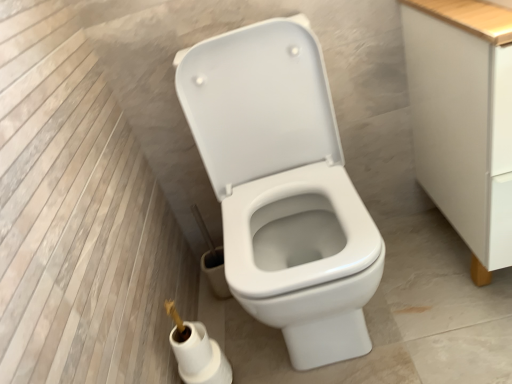
Identify the location of white matte cabinet at right. (464, 119).

Considering the relative positions of white matte toilet paper at lower center and white glossy toilet at center in the image provided, is white matte toilet paper at lower center to the right of white glossy toilet at center from the viewer's perspective?

No, white matte toilet paper at lower center is not to the right of white glossy toilet at center.

Does white matte toilet paper at lower center have a smaller size compared to white glossy toilet at center?

Indeed, white matte toilet paper at lower center has a smaller size compared to white glossy toilet at center.

From a real-world perspective, is white matte toilet paper at lower center positioned above or below white glossy toilet at center?

white matte toilet paper at lower center is situated lower than white glossy toilet at center in the real world.

Between point (467, 141) and point (248, 222), which one is positioned behind?

The point (248, 222) is farther.

From the image's perspective, which one is positioned lower, white matte cabinet at right or white glossy toilet at center?

white glossy toilet at center is shown below in the image.

Is white matte cabinet at right in front of or behind white glossy toilet at center in the image?

Visually, white matte cabinet at right is located behind white glossy toilet at center.

Considering the relative sizes of white matte cabinet at right and white glossy toilet at center in the image provided, is white matte cabinet at right bigger than white glossy toilet at center?

Incorrect, white matte cabinet at right is not larger than white glossy toilet at center.

Is white glossy toilet at center not inside white matte toilet paper at lower center?

Yes, white glossy toilet at center is outside of white matte toilet paper at lower center.

Find the location of a particular element. The width and height of the screenshot is (512, 384). toilet paper beneath the white glossy toilet at center (from a real-world perspective) is located at coordinates (200, 356).

Does white glossy toilet at center have a larger size compared to white matte toilet paper at lower center?

Yes, white glossy toilet at center is bigger than white matte toilet paper at lower center.

Does point (239, 245) come in front of point (218, 372)?

Yes, point (239, 245) is closer to viewer.

Looking at this image, from the image's perspective, is white matte cabinet at right under white matte toilet paper at lower center?

No, from the image's perspective, white matte cabinet at right is not below white matte toilet paper at lower center.

From a real-world perspective, is white matte cabinet at right on white matte toilet paper at lower center?

Yes, from a real-world perspective, white matte cabinet at right is on top of white matte toilet paper at lower center.

How far apart are white matte cabinet at right and white matte toilet paper at lower center?

They are 79.37 centimeters apart.

Are white matte cabinet at right and white matte toilet paper at lower center beside each other?

white matte cabinet at right is not next to white matte toilet paper at lower center, and they're not touching.

Is white matte toilet paper at lower center directly adjacent to white matte cabinet at right?

No, white matte toilet paper at lower center is not making contact with white matte cabinet at right.

Does white matte toilet paper at lower center appear on the left side of white matte cabinet at right?

Correct, you'll find white matte toilet paper at lower center to the left of white matte cabinet at right.

Consider the image. From the image's perspective, who appears lower, white matte toilet paper at lower center or white matte cabinet at right?

white matte toilet paper at lower center is shown below in the image.

Can you confirm if white matte toilet paper at lower center is thinner than white matte cabinet at right?

Yes.

Which of these two, white glossy toilet at center or white matte cabinet at right, is smaller?

white matte cabinet at right is smaller.

Considering the points (187, 86) and (423, 71), which point is behind, point (187, 86) or point (423, 71)?

The point (423, 71) is farther from the camera.

Considering the relative positions of white glossy toilet at center and white matte cabinet at right in the image provided, is white glossy toilet at center behind white matte cabinet at right?

No, the depth of white glossy toilet at center is less than that of white matte cabinet at right.

Is white matte cabinet at right at the back of white glossy toilet at center?

Answer: No, white glossy toilet at center is not facing away from white matte cabinet at right.

Find the location of `toilet above the white matte toilet paper at lower center (from the image's perspective)`. toilet above the white matte toilet paper at lower center (from the image's perspective) is located at coordinates (283, 187).

Locate an element on the screen. The width and height of the screenshot is (512, 384). toilet located in front of the white matte cabinet at right is located at coordinates (283, 187).

Looking at the image, which one is located further to white matte cabinet at right, white matte toilet paper at lower center or white glossy toilet at center?

Among the two, white matte toilet paper at lower center is located further to white matte cabinet at right.

Considering their positions, is white glossy toilet at center positioned closer to white matte toilet paper at lower center than white matte cabinet at right?

Result: white glossy toilet at center is positioned closer to the anchor white matte toilet paper at lower center.

From the image, which object appears to be farther from white glossy toilet at center, white matte cabinet at right or white matte toilet paper at lower center?

Among the two, white matte toilet paper at lower center is located further to white glossy toilet at center.

Looking at the image, which one is located closer to white matte cabinet at right, white glossy toilet at center or white matte toilet paper at lower center?

The object closer to white matte cabinet at right is white glossy toilet at center.

Looking at the image, which one is located further to white matte toilet paper at lower center, white matte cabinet at right or white glossy toilet at center?

white matte cabinet at right is positioned further to the anchor white matte toilet paper at lower center.

Considering their positions, is white matte toilet paper at lower center positioned further to white glossy toilet at center than white matte cabinet at right?

white matte toilet paper at lower center.

Find the location of a particular element. toilet between white matte toilet paper at lower center and white matte cabinet at right in the horizontal direction is located at coordinates (283, 187).